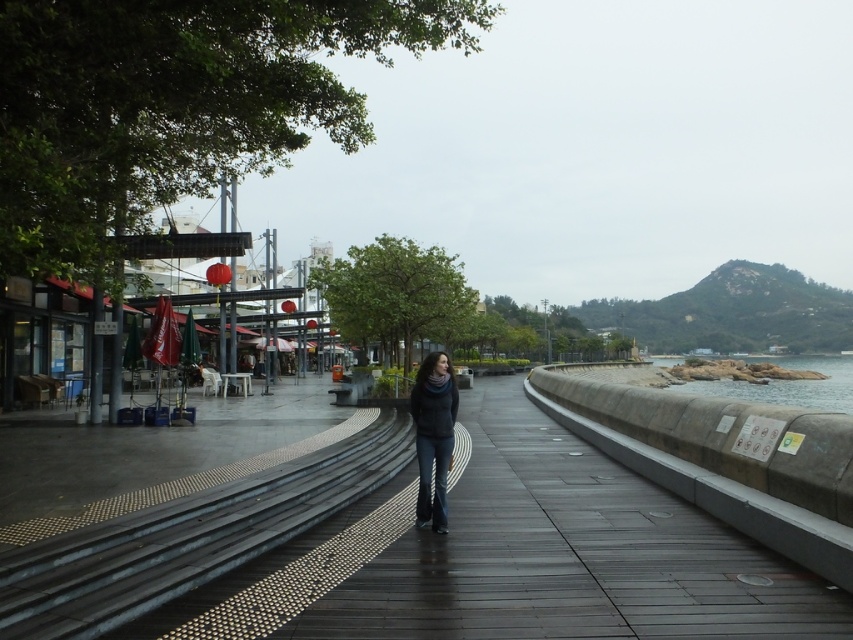
Does smooth concrete steps at lower left appear on the left side of rocky shore at right?

Indeed, smooth concrete steps at lower left is positioned on the left side of rocky shore at right.

Which is more to the right, smooth concrete steps at lower left or rocky shore at right?

Positioned to the right is rocky shore at right.

Is point (175, 566) farther from viewer compared to point (769, 392)?

No, it is not.

Locate an element on the screen. smooth concrete steps at lower left is located at coordinates (187, 538).

Who is shorter, smooth concrete steps at lower left or dark gray sweater at center?

smooth concrete steps at lower left is shorter.

Who is positioned more to the right, smooth concrete steps at lower left or dark gray sweater at center?

dark gray sweater at center is more to the right.

Is point (343, 461) less distant than point (434, 476)?

No.

You are a GUI agent. You are given a task and a screenshot of the screen. Output one action in this format:
    pyautogui.click(x=<x>, y=<y>)
    Task: Click on the smooth concrete steps at lower left
    This screenshot has height=640, width=853.
    Given the screenshot: What is the action you would take?
    pyautogui.click(x=187, y=538)

Can you confirm if wooden at center is positioned above dark gray sweater at center?

Incorrect, wooden at center is not positioned above dark gray sweater at center.

Where is `wooden at center`? The width and height of the screenshot is (853, 640). wooden at center is located at coordinates (514, 556).

Locate an element on the screen. The width and height of the screenshot is (853, 640). wooden at center is located at coordinates (514, 556).